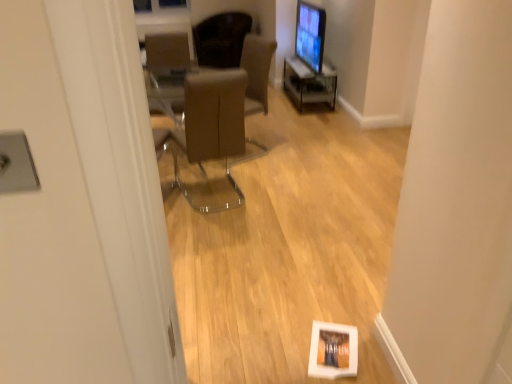
This screenshot has width=512, height=384. Describe the element at coordinates (166, 71) in the screenshot. I see `brown leather chair at center, which ranks as the second chair in back-to-front order` at that location.

The height and width of the screenshot is (384, 512). Find the location of `dark brown leather chair at upper center, the first chair viewed from the back`. dark brown leather chair at upper center, the first chair viewed from the back is located at coordinates (221, 39).

Between brown leather chair at center, which ranks as the second chair in front-to-back order, and matte black monitor at upper right, which one has smaller width?

With smaller width is matte black monitor at upper right.

Does brown leather chair at center, the 2th chair when ordered from bottom to top, come in front of matte black monitor at upper right?

Yes, it is.

From a real-world perspective, which is physically above, brown leather chair at center, the 2th chair when ordered from bottom to top, or matte black monitor at upper right?

In real-world perspective, matte black monitor at upper right is above.

Does point (158, 41) come in front of point (236, 41)?

No, (158, 41) is behind (236, 41).

Considering the relative sizes of brown leather chair at center, the 2th chair when ordered from bottom to top, and dark brown leather chair at upper center, the first chair viewed from the back, in the image provided, is brown leather chair at center, the 2th chair when ordered from bottom to top, smaller than dark brown leather chair at upper center, the first chair viewed from the back,?

Correct, brown leather chair at center, the 2th chair when ordered from bottom to top, occupies less space than dark brown leather chair at upper center, the first chair viewed from the back.

Considering the sizes of brown leather chair at center, which ranks as the second chair in back-to-front order, and dark brown leather chair at upper center, the third chair when ordered from front to back, in the image, is brown leather chair at center, which ranks as the second chair in back-to-front order, wider or thinner than dark brown leather chair at upper center, the third chair when ordered from front to back,?

brown leather chair at center, which ranks as the second chair in back-to-front order, is thinner than dark brown leather chair at upper center, the third chair when ordered from front to back.

Between point (222, 101) and point (297, 13), which one is positioned behind?

The point (297, 13) is farther from the camera.

From the image's perspective, which is above, brown leather chair at center, the third chair positioned from the back, or matte black monitor at upper right?

matte black monitor at upper right is shown above in the image.

How distant is brown leather chair at center, the first chair in the bottom-to-top sequence, from matte black monitor at upper right?

brown leather chair at center, the first chair in the bottom-to-top sequence, and matte black monitor at upper right are 7.90 feet apart from each other.

From a real-world perspective, does brown leather chair at center, the third chair positioned from the back, stand above matte black monitor at upper right?

No, from a real-world perspective, brown leather chair at center, the third chair positioned from the back, is not above matte black monitor at upper right.

Does dark brown leather chair at upper center, the first chair viewed from the back, have a larger size compared to matte black monitor at upper right?

Indeed, dark brown leather chair at upper center, the first chair viewed from the back, has a larger size compared to matte black monitor at upper right.

Is dark brown leather chair at upper center, the third chair when ordered from bottom to top, in front of or behind matte black monitor at upper right in the image?

dark brown leather chair at upper center, the third chair when ordered from bottom to top, is behind matte black monitor at upper right.

Who is taller, dark brown leather chair at upper center, the first chair viewed from the back, or matte black monitor at upper right?

matte black monitor at upper right.

How different are the orientations of dark brown leather chair at upper center, the first chair viewed from the back, and matte black monitor at upper right in degrees?

The angular difference between dark brown leather chair at upper center, the first chair viewed from the back, and matte black monitor at upper right is 49.5 degrees.

Which of these two, brown leather chair at center, the first chair in the bottom-to-top sequence, or brown leather chair at center, which ranks as the second chair in back-to-front order, is wider?

Wider between the two is brown leather chair at center, the first chair in the bottom-to-top sequence.

What's the angular difference between brown leather chair at center, the first chair in the bottom-to-top sequence, and brown leather chair at center, which ranks as the second chair in front-to-back order,'s facing directions?

166 degrees.

From a real-world perspective, between brown leather chair at center, the third chair positioned from the back, and brown leather chair at center, which ranks as the second chair in back-to-front order, who is vertically higher?

brown leather chair at center, which ranks as the second chair in back-to-front order, is physically above.

Consider the image. Is brown leather chair at center, the first chair in the bottom-to-top sequence, to the left of brown leather chair at center, which ranks as the second chair in back-to-front order, from the viewer's perspective?

Incorrect, brown leather chair at center, the first chair in the bottom-to-top sequence, is not on the left side of brown leather chair at center, which ranks as the second chair in back-to-front order.

Based on the photo, is matte black monitor at upper right positioned with its back to dark brown leather chair at upper center, which is the first chair in top-to-bottom order?

That's not correct — matte black monitor at upper right is not looking away from dark brown leather chair at upper center, which is the first chair in top-to-bottom order.

Is matte black monitor at upper right next to dark brown leather chair at upper center, the third chair when ordered from bottom to top?

There is a gap between matte black monitor at upper right and dark brown leather chair at upper center, the third chair when ordered from bottom to top.

Based on their sizes in the image, would you say matte black monitor at upper right is bigger or smaller than dark brown leather chair at upper center, the third chair when ordered from front to back?

Considering their sizes, matte black monitor at upper right takes up less space than dark brown leather chair at upper center, the third chair when ordered from front to back.

From a real-world perspective, is dark brown leather chair at upper center, the third chair when ordered from bottom to top, physically below brown leather chair at center, the first chair when ordered from front to back?

No, from a real-world perspective, dark brown leather chair at upper center, the third chair when ordered from bottom to top, is not beneath brown leather chair at center, the first chair when ordered from front to back.

Is point (215, 65) less distant than point (189, 84)?

No, (215, 65) is further to viewer.

Which is more to the right, dark brown leather chair at upper center, the first chair viewed from the back, or brown leather chair at center, the first chair when ordered from front to back?

brown leather chair at center, the first chair when ordered from front to back.

Between dark brown leather chair at upper center, the third chair when ordered from front to back, and brown leather chair at center, the first chair when ordered from front to back, which one is positioned behind?

Positioned behind is dark brown leather chair at upper center, the third chair when ordered from front to back.

Find the location of a particular element. the 3rd chair to the left of the matte black monitor at upper right, counting from the anchor's position is located at coordinates (166, 71).

At what (x,y) coordinates should I click in order to perform the action: click on chair located above the brown leather chair at center, arranged as the 2th chair when viewed from the top (from a real-world perspective). Please return your answer as a coordinate pair (x, y). Image resolution: width=512 pixels, height=384 pixels. Looking at the image, I should click on (221, 39).

From the image, which object appears to be farther from brown leather chair at center, the third chair positioned from the top, dark brown leather chair at upper center, the first chair viewed from the back, or brown leather chair at center, which ranks as the second chair in back-to-front order?

dark brown leather chair at upper center, the first chair viewed from the back, is further to brown leather chair at center, the third chair positioned from the top.

Based on their spatial positions, is brown leather chair at center, the third chair positioned from the top, or matte black monitor at upper right closer to dark brown leather chair at upper center, the third chair when ordered from front to back?

brown leather chair at center, the third chair positioned from the top, is closer to dark brown leather chair at upper center, the third chair when ordered from front to back.

Estimate the real-world distances between objects in this image. Which object is closer to matte black monitor at upper right, brown leather chair at center, which ranks as the second chair in front-to-back order, or dark brown leather chair at upper center, the first chair viewed from the back?

Based on the image, dark brown leather chair at upper center, the first chair viewed from the back, appears to be nearer to matte black monitor at upper right.

Considering their positions, is dark brown leather chair at upper center, which is the first chair in top-to-bottom order, positioned closer to matte black monitor at upper right than brown leather chair at center, which ranks as the second chair in front-to-back order?

The object closer to matte black monitor at upper right is dark brown leather chair at upper center, which is the first chair in top-to-bottom order.

From the image, which object appears to be nearer to dark brown leather chair at upper center, the third chair when ordered from bottom to top, matte black monitor at upper right or brown leather chair at center, which ranks as the second chair in front-to-back order?

The object closer to dark brown leather chair at upper center, the third chair when ordered from bottom to top, is brown leather chair at center, which ranks as the second chair in front-to-back order.

Looking at the image, which one is located closer to brown leather chair at center, the first chair when ordered from front to back, matte black monitor at upper right or dark brown leather chair at upper center, the third chair when ordered from bottom to top?

dark brown leather chair at upper center, the third chair when ordered from bottom to top.

Estimate the real-world distances between objects in this image. Which object is closer to matte black monitor at upper right, brown leather chair at center, the 2th chair when ordered from bottom to top, or brown leather chair at center, the third chair positioned from the back?

brown leather chair at center, the 2th chair when ordered from bottom to top, lies closer to matte black monitor at upper right than the other object.

Based on their spatial positions, is dark brown leather chair at upper center, the third chair when ordered from bottom to top, or brown leather chair at center, the third chair positioned from the back, closer to matte black monitor at upper right?

Among the two, dark brown leather chair at upper center, the third chair when ordered from bottom to top, is located nearer to matte black monitor at upper right.

Where is `computer monitor between brown leather chair at center, the first chair in the bottom-to-top sequence, and dark brown leather chair at upper center, the third chair when ordered from front to back, from front to back`? The width and height of the screenshot is (512, 384). computer monitor between brown leather chair at center, the first chair in the bottom-to-top sequence, and dark brown leather chair at upper center, the third chair when ordered from front to back, from front to back is located at coordinates (310, 35).

Identify the location of chair located between brown leather chair at center, the first chair in the bottom-to-top sequence, and dark brown leather chair at upper center, which is the first chair in top-to-bottom order, in the depth direction. The image size is (512, 384). pyautogui.click(x=166, y=71).

Find the location of a particular element. This screenshot has width=512, height=384. chair positioned between brown leather chair at center, the first chair in the bottom-to-top sequence, and matte black monitor at upper right from near to far is located at coordinates (166, 71).

The image size is (512, 384). Find the location of `computer monitor between brown leather chair at center, which ranks as the second chair in front-to-back order, and dark brown leather chair at upper center, which is the first chair in top-to-bottom order, from front to back`. computer monitor between brown leather chair at center, which ranks as the second chair in front-to-back order, and dark brown leather chair at upper center, which is the first chair in top-to-bottom order, from front to back is located at coordinates (310, 35).